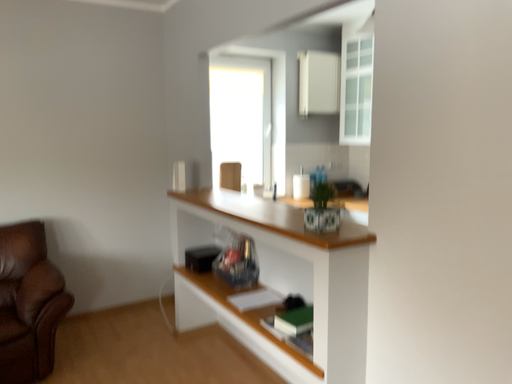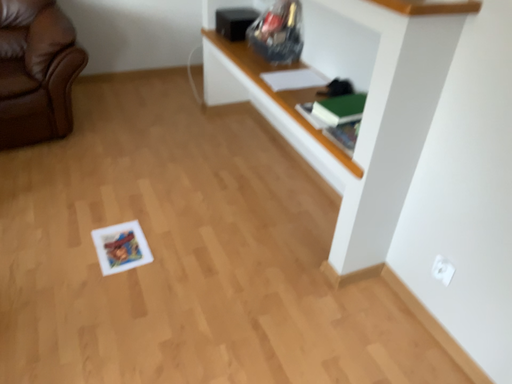
Question: How did the camera likely rotate when shooting the video?

Choices:
 (A) rotated left
 (B) rotated right

Answer: (A)